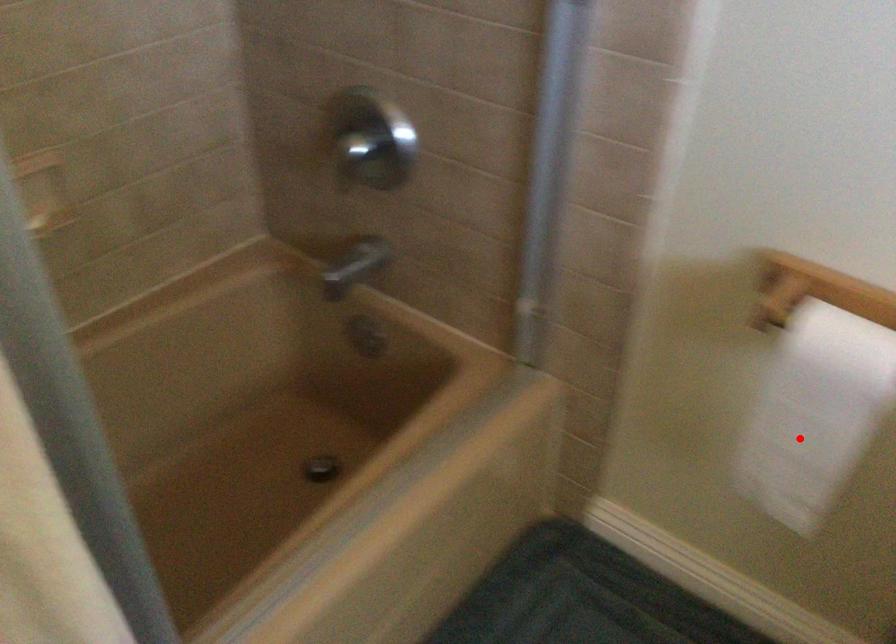
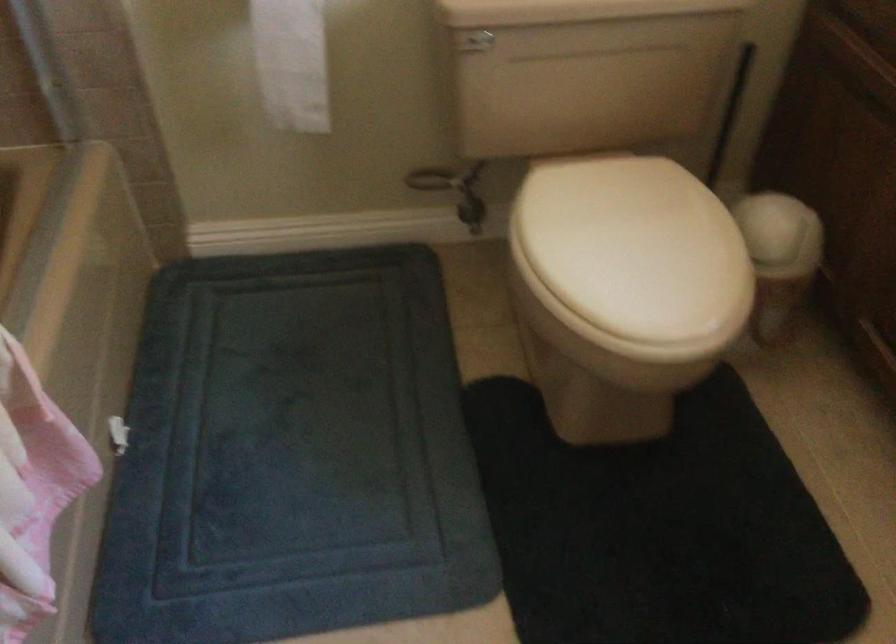
Question: A red point is marked in image1. In image2, is the corresponding 3D point closer to the camera or farther? Reply with the corresponding letter.

Choices:
 (A) The corresponding 3D point is closer.
 (B) The corresponding 3D point is farther.

Answer: (B)